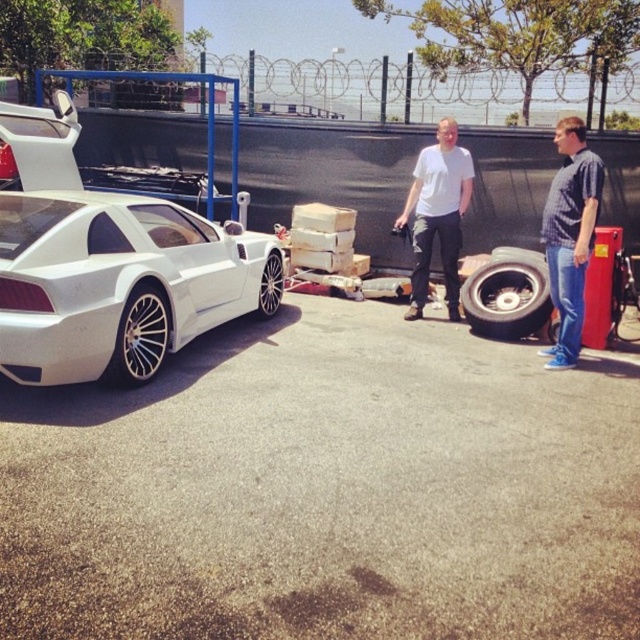
You are a photographer trying to capture the white matte sports car at left and the blue plaid shirt at right in the same frame. Since the car is larger than the shirt, how might you adjust your camera position to ensure both are visible proportionally?

The white matte sports car at left is larger than the blue plaid shirt at right. To balance their sizes in the frame, move closer to the blue plaid shirt at right and farther from the white matte sports car at left.

You are a photographer standing at the center of the scene. You want to take a photo of the white matte sports car at left and the white matte shirt at center. If your camera has a maximum focus range of 8 feet, can you capture both subjects clearly in the same photo?

The white matte sports car at left and white matte shirt at center are 8.58 feet apart from each other. Since the distance between them exceeds the camera maximum focus range of 8 feet, you cannot capture both subjects clearly in the same photo.